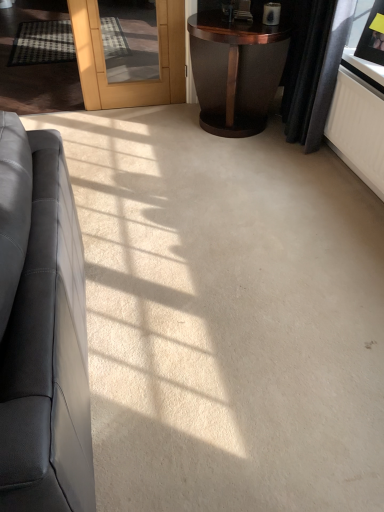
Question: Can you confirm if black velvet curtain at upper right is smaller than matte black couch at left?

Choices:
 (A) yes
 (B) no

Answer: (A)

Question: Considering the relative positions of black velvet curtain at upper right and matte black couch at left in the image provided, is black velvet curtain at upper right to the right of matte black couch at left from the viewer's perspective?

Choices:
 (A) yes
 (B) no

Answer: (A)

Question: Considering the relative sizes of black velvet curtain at upper right and matte black couch at left in the image provided, is black velvet curtain at upper right wider than matte black couch at left?

Choices:
 (A) no
 (B) yes

Answer: (A)

Question: Could you tell me if black velvet curtain at upper right is turned towards matte black couch at left?

Choices:
 (A) no
 (B) yes

Answer: (A)

Question: Does black velvet curtain at upper right have a greater height compared to matte black couch at left?

Choices:
 (A) yes
 (B) no

Answer: (A)

Question: Is black velvet curtain at upper right with matte black couch at left?

Choices:
 (A) no
 (B) yes

Answer: (A)

Question: From the image's perspective, is dark wood side table at upper right below matte black couch at left?

Choices:
 (A) no
 (B) yes

Answer: (A)

Question: Can you confirm if dark wood side table at upper right is shorter than matte black couch at left?

Choices:
 (A) yes
 (B) no

Answer: (A)

Question: Does dark wood side table at upper right appear on the left side of matte black couch at left?

Choices:
 (A) no
 (B) yes

Answer: (A)

Question: From a real-world perspective, is dark wood side table at upper right positioned under matte black couch at left based on gravity?

Choices:
 (A) no
 (B) yes

Answer: (B)

Question: Is dark wood side table at upper right not inside matte black couch at left?

Choices:
 (A) yes
 (B) no

Answer: (A)

Question: Does dark wood side table at upper right have a lesser width compared to matte black couch at left?

Choices:
 (A) yes
 (B) no

Answer: (B)

Question: From a real-world perspective, is black velvet curtain at upper right positioned under matte black picture frame at upper right based on gravity?

Choices:
 (A) no
 (B) yes

Answer: (B)